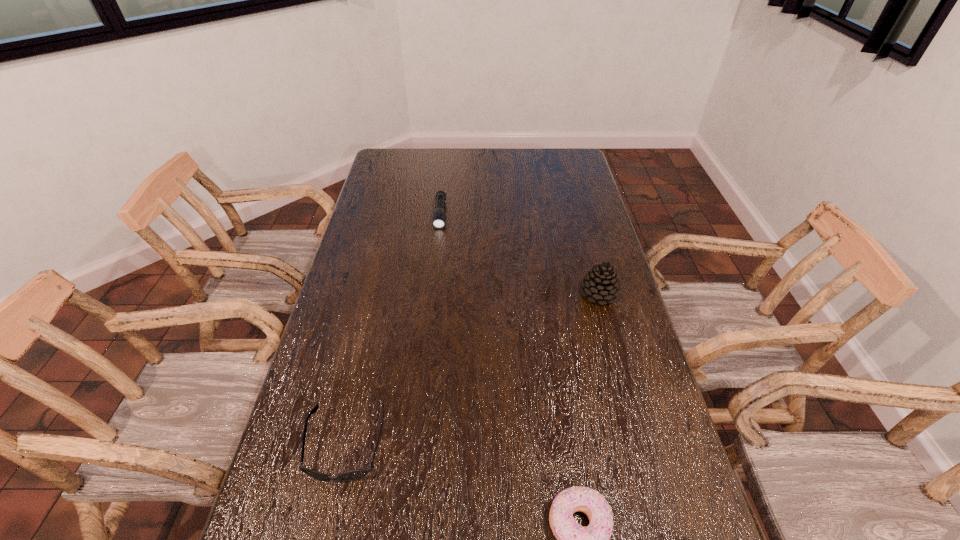
At what (x,y) coordinates should I click in order to perform the action: click on free spot located at the narrow end of the tallest object. Please return your answer as a coordinate pair (x, y). The image size is (960, 540). Looking at the image, I should click on (556, 343).

Locate an element on the screen. This screenshot has width=960, height=540. vacant space situated at the narrow end of the tallest object is located at coordinates (582, 314).

Where is `vacant area located 0.310m at the narrow end of the tallest object`? The height and width of the screenshot is (540, 960). vacant area located 0.310m at the narrow end of the tallest object is located at coordinates (534, 368).

You are a GUI agent. You are given a task and a screenshot of the screen. Output one action in this format:
    pyautogui.click(x=<x>, y=<y>)
    Task: Click on the object at the left edge
    Image resolution: width=960 pixels, height=540 pixels.
    Given the screenshot: What is the action you would take?
    pyautogui.click(x=352, y=475)

Locate an element on the screen. This screenshot has height=540, width=960. object present at the right edge is located at coordinates (601, 283).

Where is `vacant area at the far edge`? The height and width of the screenshot is (540, 960). vacant area at the far edge is located at coordinates (538, 163).

Locate an element on the screen. This screenshot has height=540, width=960. free space at the left edge of the desktop is located at coordinates (374, 239).

You are a GUI agent. You are given a task and a screenshot of the screen. Output one action in this format:
    pyautogui.click(x=<x>, y=<y>)
    Task: Click on the vacant space at the right edge of the desktop
    The height and width of the screenshot is (540, 960).
    Given the screenshot: What is the action you would take?
    pyautogui.click(x=644, y=414)

What are the coordinates of `vacant area at the far left corner` in the screenshot? It's located at (385, 154).

Identify the location of free point at the near left corner. (265, 519).